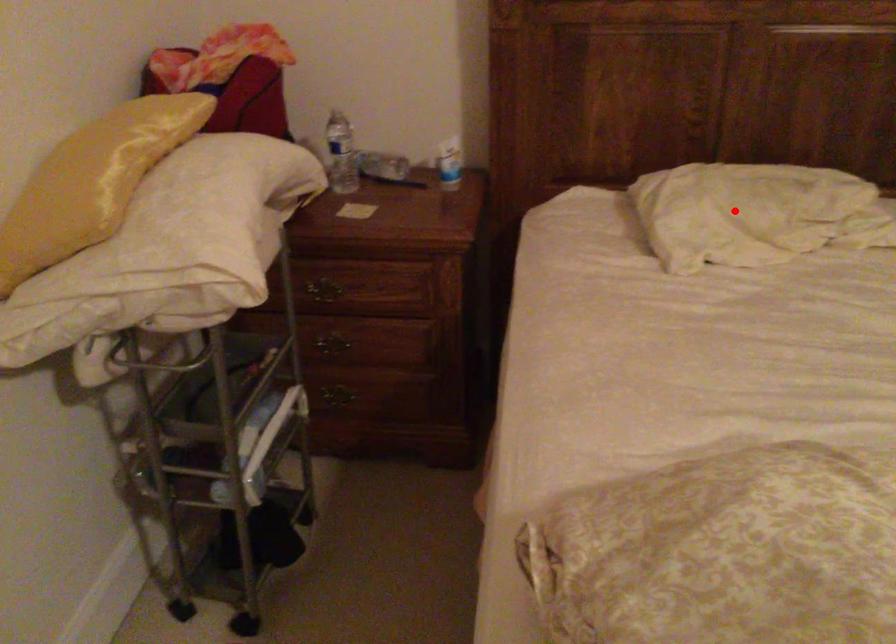
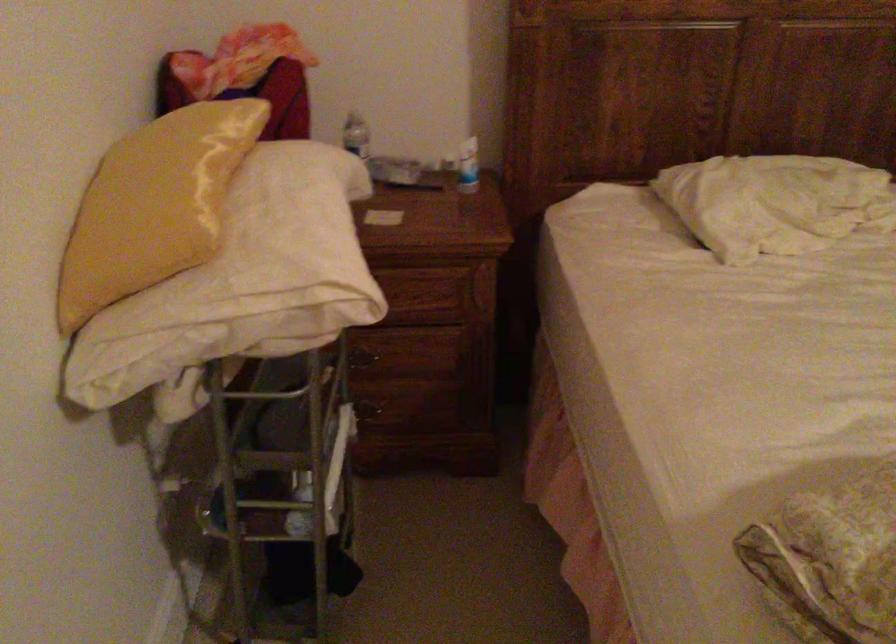
Locate, in the second image, the point that corresponds to the highlighted location in the first image.

(774, 202)